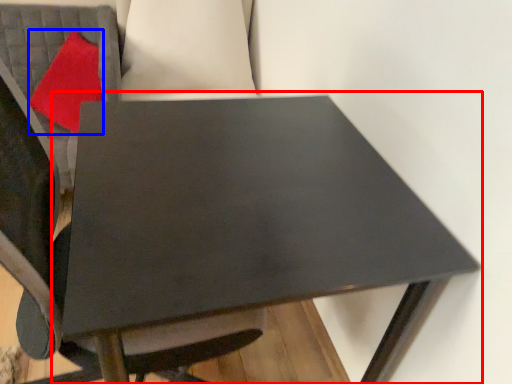
Question: Which object appears closest to the camera in this image, table (highlighted by a red box) or pillow (highlighted by a blue box)?

Choices:
 (A) table
 (B) pillow

Answer: (A)